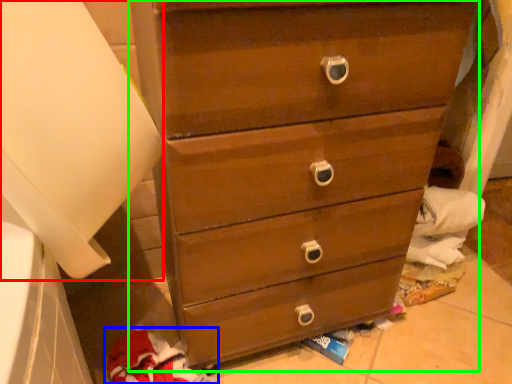
Question: Which is farther away from paper towel (highlighted by a red box)? clothing (highlighted by a blue box) or chest of drawers (highlighted by a green box)?

Choices:
 (A) clothing
 (B) chest of drawers

Answer: (A)